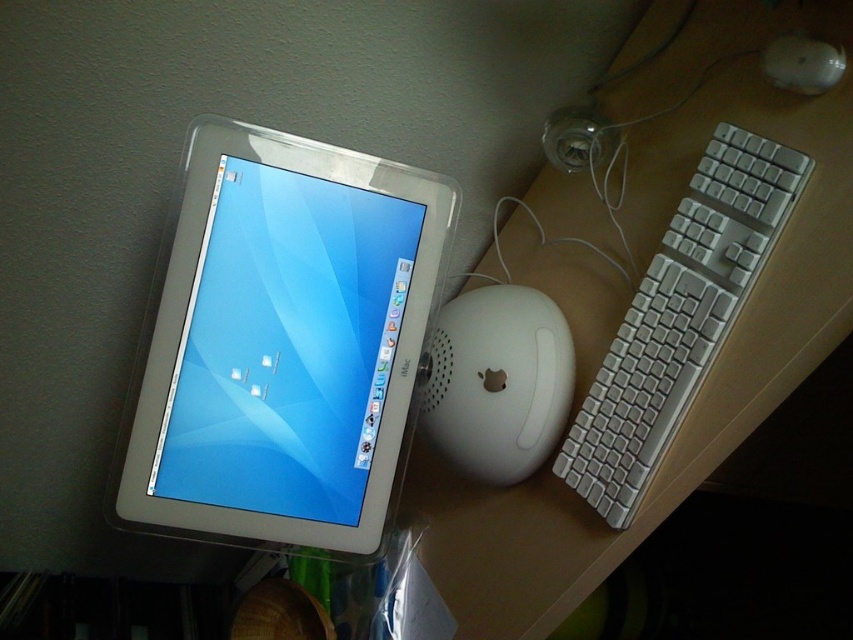
Question: Is white matte mouse at center to the right of white glossy mouse at upper right from the viewer's perspective?

Choices:
 (A) yes
 (B) no

Answer: (B)

Question: Considering the real-world distances, which object is closest to the white matte mouse at center?

Choices:
 (A) white glossy mouse at upper right
 (B) white glossy computer monitor at upper left

Answer: (B)

Question: Can you confirm if white matte mouse at center is wider than white glossy mouse at upper right?

Choices:
 (A) yes
 (B) no

Answer: (A)

Question: Estimate the real-world distances between objects in this image. Which object is farther from the white matte mouse at center?

Choices:
 (A) white glossy mouse at upper right
 (B) white glossy computer monitor at upper left

Answer: (A)

Question: Does white glossy computer monitor at upper left have a greater width compared to white glossy mouse at upper right?

Choices:
 (A) no
 (B) yes

Answer: (B)

Question: Which point appears farthest from the camera in this image?

Choices:
 (A) (807, 36)
 (B) (614, 481)

Answer: (B)